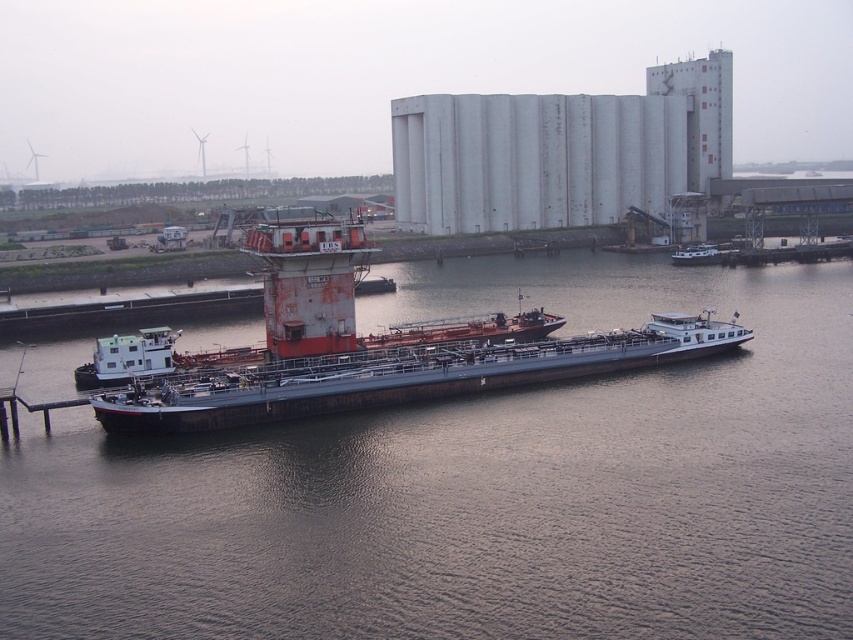
You are standing on the dock and want to throw a frisbee to your friend who is on the brown wooden river at center. The frisbee can travel 70 feet. Will it reach them?

The brown wooden river at center is 75.24 feet away from the viewer. Since the frisbee can only travel 70 feet, it will not reach your friend.

You are standing at the point marked by the coordinates point (128, 358) in the image. Looking around, you see the white plastic houseboat at center left. Which direction would you face to look towards the barge docked at the port?

The white plastic houseboat at center left is located at point (128, 358). Since the barge is docked at the port, which is the main area in the scene, facing towards the barge from the houseboat would mean turning towards the center or right side of the image where the barge is positioned.